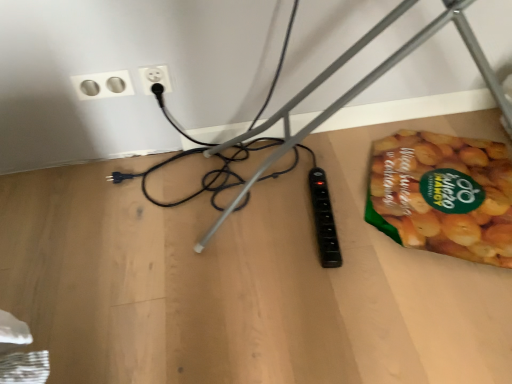
Question: Can you confirm if white plastic socket at upper center, positioned as the first power plugs and sockets in right-to-left order, is thinner than wooden table at lower right?

Choices:
 (A) no
 (B) yes

Answer: (B)

Question: Is white plastic socket at upper center, positioned as the first power plugs and sockets in right-to-left order, at the left side of wooden table at lower right?

Choices:
 (A) yes
 (B) no

Answer: (A)

Question: Can wooden table at lower right be found inside white plastic socket at upper center, the 2th power plugs and sockets positioned from the left?

Choices:
 (A) yes
 (B) no

Answer: (B)

Question: Can you confirm if white plastic socket at upper center, the 2th power plugs and sockets positioned from the left, is positioned to the right of wooden table at lower right?

Choices:
 (A) no
 (B) yes

Answer: (A)

Question: Are white plastic socket at upper center, the 2th power plugs and sockets positioned from the left, and wooden table at lower right far apart?

Choices:
 (A) no
 (B) yes

Answer: (A)

Question: Is point (157, 74) closer or farther from the camera than point (248, 382)?

Choices:
 (A) farther
 (B) closer

Answer: (A)

Question: Relative to wooden table at lower right, is white plastic socket at upper center, the 2th power plugs and sockets positioned from the left, in front or behind?

Choices:
 (A) front
 (B) behind

Answer: (B)

Question: In terms of width, does white plastic socket at upper center, the 2th power plugs and sockets positioned from the left, look wider or thinner when compared to wooden table at lower right?

Choices:
 (A) thin
 (B) wide

Answer: (A)

Question: From the image's perspective, relative to wooden table at lower right, is white plastic socket at upper center, positioned as the first power plugs and sockets in right-to-left order, above or below?

Choices:
 (A) below
 (B) above

Answer: (B)

Question: Is green matte snack packet at lower right in front of or behind wooden table at lower right in the image?

Choices:
 (A) front
 (B) behind

Answer: (B)

Question: Considering the positions of green matte snack packet at lower right and wooden table at lower right in the image, is green matte snack packet at lower right taller or shorter than wooden table at lower right?

Choices:
 (A) tall
 (B) short

Answer: (A)

Question: Is green matte snack packet at lower right wider or thinner than wooden table at lower right?

Choices:
 (A) thin
 (B) wide

Answer: (A)

Question: Is point (404, 155) closer or farther from the camera than point (82, 271)?

Choices:
 (A) farther
 (B) closer

Answer: (A)

Question: Relative to green matte snack packet at lower right, is white plastic socket at upper center, positioned as the first power plugs and sockets in right-to-left order, in front or behind?

Choices:
 (A) front
 (B) behind

Answer: (B)

Question: From a real-world perspective, is white plastic socket at upper center, positioned as the first power plugs and sockets in right-to-left order, above or below green matte snack packet at lower right?

Choices:
 (A) above
 (B) below

Answer: (A)